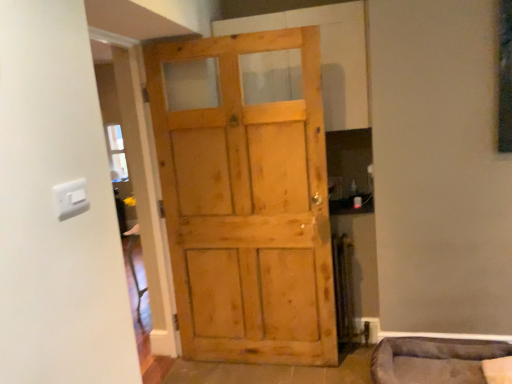
Question: Is velvet grey pet bed at lower right positioned with its back to white plastic light switch at upper left?

Choices:
 (A) no
 (B) yes

Answer: (A)

Question: Can you confirm if velvet grey pet bed at lower right is smaller than white plastic light switch at upper left?

Choices:
 (A) no
 (B) yes

Answer: (A)

Question: Is velvet grey pet bed at lower right not near white plastic light switch at upper left?

Choices:
 (A) yes
 (B) no

Answer: (A)

Question: From the image's perspective, does velvet grey pet bed at lower right appear lower than white plastic light switch at upper left?

Choices:
 (A) no
 (B) yes

Answer: (B)

Question: Does velvet grey pet bed at lower right have a lesser width compared to white plastic light switch at upper left?

Choices:
 (A) yes
 (B) no

Answer: (B)

Question: From the image's perspective, is velvet grey pet bed at lower right above or below light brown wooden door at center?

Choices:
 (A) below
 (B) above

Answer: (A)

Question: Is point (432, 370) closer or farther from the camera than point (168, 57)?

Choices:
 (A) farther
 (B) closer

Answer: (B)

Question: Considering the positions of velvet grey pet bed at lower right and light brown wooden door at center in the image, is velvet grey pet bed at lower right taller or shorter than light brown wooden door at center?

Choices:
 (A) short
 (B) tall

Answer: (A)

Question: Is velvet grey pet bed at lower right spatially inside light brown wooden door at center, or outside of it?

Choices:
 (A) inside
 (B) outside

Answer: (B)

Question: In terms of width, does velvet grey pet bed at lower right look wider or thinner when compared to white plastic light switch at upper left?

Choices:
 (A) wide
 (B) thin

Answer: (A)

Question: From the image's perspective, relative to white plastic light switch at upper left, is velvet grey pet bed at lower right above or below?

Choices:
 (A) below
 (B) above

Answer: (A)

Question: From a real-world perspective, relative to white plastic light switch at upper left, is velvet grey pet bed at lower right vertically above or below?

Choices:
 (A) below
 (B) above

Answer: (A)

Question: Is velvet grey pet bed at lower right bigger or smaller than white plastic light switch at upper left?

Choices:
 (A) big
 (B) small

Answer: (A)

Question: From a real-world perspective, is white plastic light switch at upper left above or below velvet grey pet bed at lower right?

Choices:
 (A) above
 (B) below

Answer: (A)

Question: Considering the positions of white plastic light switch at upper left and velvet grey pet bed at lower right in the image, is white plastic light switch at upper left wider or thinner than velvet grey pet bed at lower right?

Choices:
 (A) wide
 (B) thin

Answer: (B)